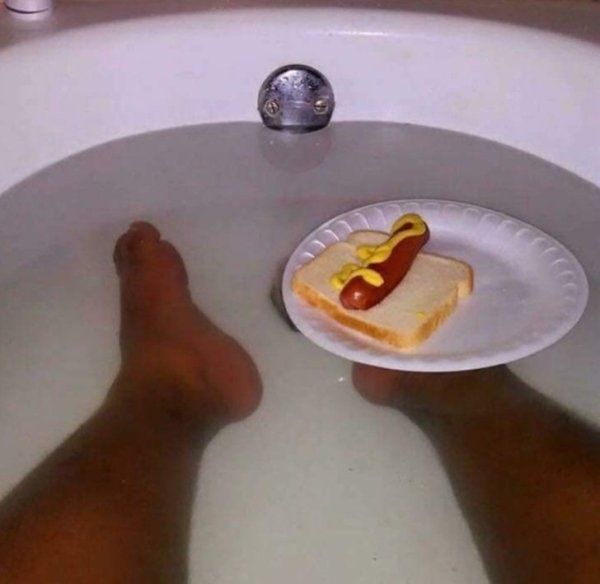
Locate an element on the screen. This screenshot has height=584, width=600. bathtub is located at coordinates (387, 81).